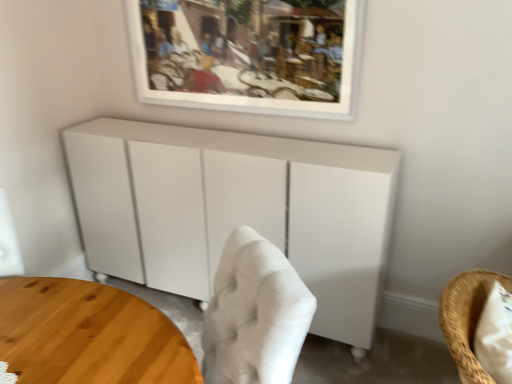
Question: Can you confirm if wooden round table at lower left is bigger than woven straw chair at lower right?

Choices:
 (A) yes
 (B) no

Answer: (A)

Question: Is wooden round table at lower left thinner than woven straw chair at lower right?

Choices:
 (A) no
 (B) yes

Answer: (A)

Question: Does wooden round table at lower left have a lesser height compared to woven straw chair at lower right?

Choices:
 (A) yes
 (B) no

Answer: (B)

Question: Is wooden round table at lower left aimed at woven straw chair at lower right?

Choices:
 (A) no
 (B) yes

Answer: (A)

Question: Is woven straw chair at lower right at the back of wooden round table at lower left?

Choices:
 (A) yes
 (B) no

Answer: (B)

Question: Is wooden round table at lower left closer to the viewer compared to woven straw chair at lower right?

Choices:
 (A) yes
 (B) no

Answer: (A)

Question: From a real-world perspective, is white matte cabinet at center over wooden round table at lower left?

Choices:
 (A) no
 (B) yes

Answer: (B)

Question: Is white matte cabinet at center thinner than wooden round table at lower left?

Choices:
 (A) no
 (B) yes

Answer: (B)

Question: Considering the relative sizes of white matte cabinet at center and wooden round table at lower left in the image provided, is white matte cabinet at center shorter than wooden round table at lower left?

Choices:
 (A) yes
 (B) no

Answer: (B)

Question: Is wooden round table at lower left completely or partially inside white matte cabinet at center?

Choices:
 (A) yes
 (B) no

Answer: (B)

Question: Is white matte cabinet at center further to camera compared to wooden round table at lower left?

Choices:
 (A) yes
 (B) no

Answer: (A)

Question: From the image's perspective, is white matte cabinet at center located beneath wooden round table at lower left?

Choices:
 (A) yes
 (B) no

Answer: (B)

Question: Does woven straw chair at lower right have a lesser height compared to white matte picture frame at upper center?

Choices:
 (A) no
 (B) yes

Answer: (B)